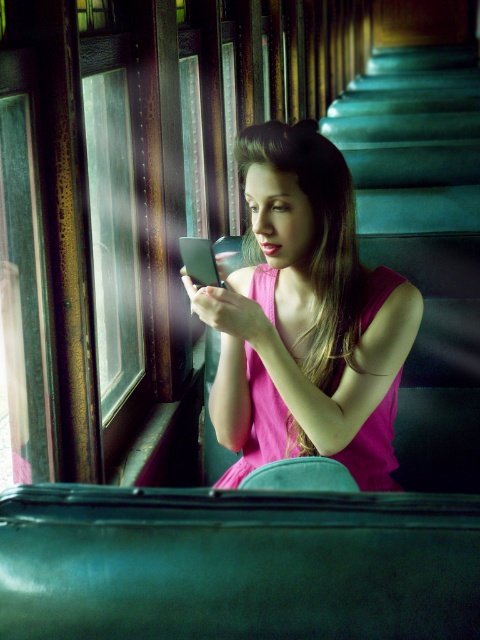
Question: Can you confirm if pink satin dress at center is positioned below green plush stairs at right?

Choices:
 (A) no
 (B) yes

Answer: (B)

Question: Is pink satin dress at center above green plush stairs at right?

Choices:
 (A) no
 (B) yes

Answer: (A)

Question: Can you confirm if pink satin dress at center is bigger than green plush stairs at right?

Choices:
 (A) no
 (B) yes

Answer: (A)

Question: Among these objects, which one is farthest from the camera?

Choices:
 (A) pink satin dress at center
 (B) green plush stairs at right

Answer: (B)